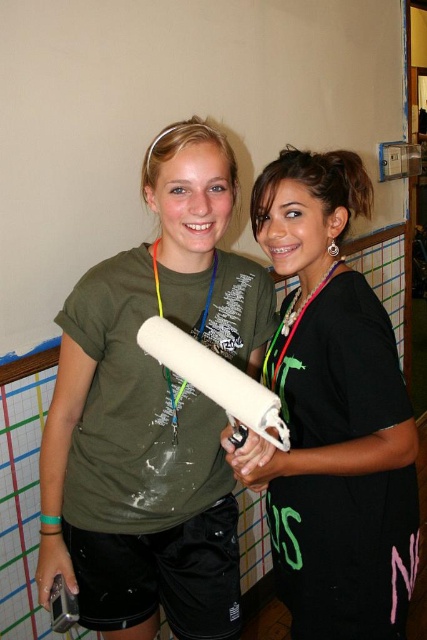
You are a photographer trying to capture the perfect shot of the black matte shirt at center. Given that the camera focuses on the point at coordinates point (335, 413), will the black matte shirt at center be in focus?

The point (335, 413) corresponds to the black matte shirt at center, so yes, the black matte shirt at center will be in focus as the camera focuses on that point.

You are an interior designer assessing the clothing items in the scene. Which object, the black matte shirt at center or the neon plastic lanyard at center, has a greater width?

The black matte shirt at center has a greater width than the neon plastic lanyard at center according to the description.